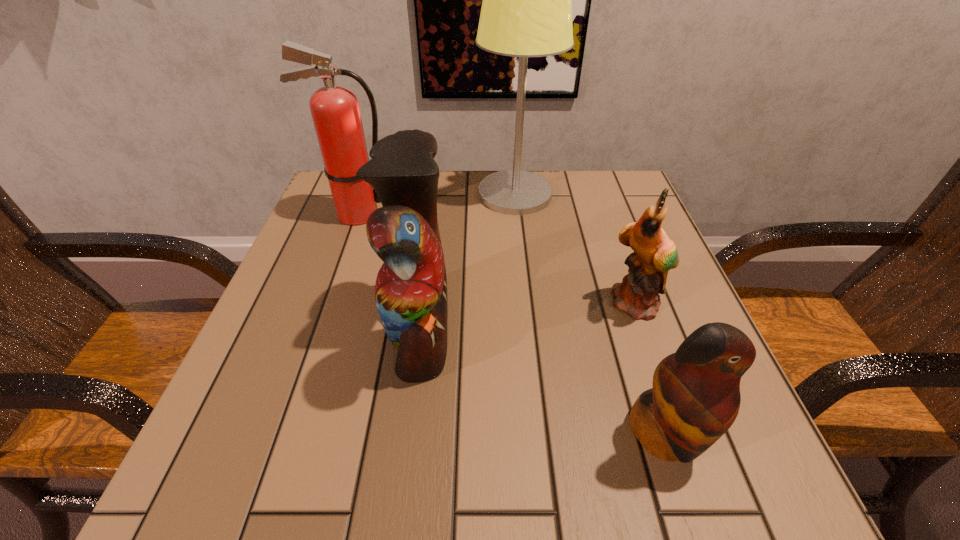
What are the coordinates of `free region at the far right corner` in the screenshot? It's located at (585, 212).

Where is `free space at the near right corner`? The height and width of the screenshot is (540, 960). free space at the near right corner is located at coordinates (719, 458).

Identify the location of empty space that is in between the tallest parrot and the nearest parrot. This screenshot has width=960, height=540. point(543,382).

Image resolution: width=960 pixels, height=540 pixels. Find the location of `vacant area between the table lamp and the nearest object`. vacant area between the table lamp and the nearest object is located at coordinates (590, 314).

The width and height of the screenshot is (960, 540). I want to click on vacant space that is in between the nearest parrot and the third object from left to right, so click(590, 314).

This screenshot has width=960, height=540. In order to click on free space between the nearest parrot and the tallest parrot in this screenshot , I will do `click(543, 382)`.

Locate an element on the screen. The image size is (960, 540). object that is the third closest to the table lamp is located at coordinates (654, 254).

Select which object appears as the closest to the nearest parrot. Please provide its 2D coordinates. Your answer should be formatted as a tuple, i.e. [(x, y)], where the tuple contains the x and y coordinates of a point satisfying the conditions above.

[(654, 254)]

Select which parrot appears as the third closest to the leftmost object. Please provide its 2D coordinates. Your answer should be formatted as a tuple, i.e. [(x, y)], where the tuple contains the x and y coordinates of a point satisfying the conditions above.

[(695, 398)]

Identify the location of the second closest parrot to the fourth object from right to left. This screenshot has height=540, width=960. (654, 254).